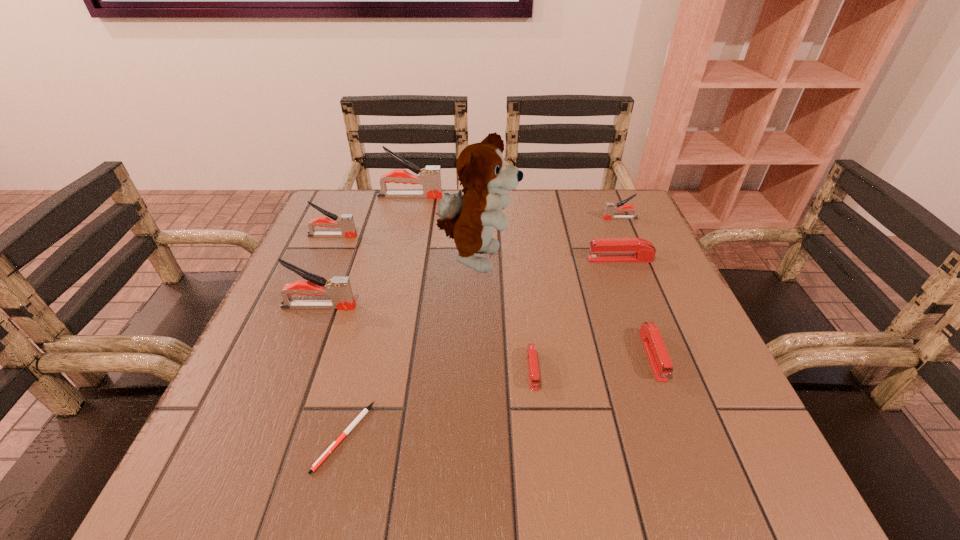
Identify the location of vacant space located 0.280m on the handle side of the sixth shortest stapler. The image size is (960, 540). (491, 307).

You are a GUI agent. You are given a task and a screenshot of the screen. Output one action in this format:
    pyautogui.click(x=<x>, y=<y>)
    Task: Click on the vacant area located 0.350m on the handle side of the second smallest gray stapler
    This screenshot has height=540, width=960.
    Given the screenshot: What is the action you would take?
    pyautogui.click(x=496, y=236)

This screenshot has width=960, height=540. Find the location of `vacant space located 0.280m on the handle side of the rightmost gray stapler`. vacant space located 0.280m on the handle side of the rightmost gray stapler is located at coordinates (496, 218).

Where is `vacant region located on the handle side of the rightmost gray stapler`? vacant region located on the handle side of the rightmost gray stapler is located at coordinates (554, 218).

At what (x,y) coordinates should I click in order to perform the action: click on vacant space located on the handle side of the rightmost gray stapler. Please return your answer as a coordinate pair (x, y). This screenshot has width=960, height=540. Looking at the image, I should click on (500, 218).

At what (x,y) coordinates should I click in order to perform the action: click on free point located 0.210m on the front-facing side of the sixth tallest object. Please return your answer as a coordinate pair (x, y). This screenshot has width=960, height=540. Looking at the image, I should click on (498, 259).

Locate an element on the screen. The height and width of the screenshot is (540, 960). free space located 0.220m on the front-facing side of the sixth tallest object is located at coordinates (493, 259).

I want to click on vacant space located 0.300m on the front-facing side of the sixth tallest object, so click(460, 259).

This screenshot has width=960, height=540. I want to click on vacant space located on the front-facing side of the second smallest red stapler, so click(x=699, y=480).

What are the coordinates of `free region located 0.140m on the front-facing side of the second shortest object` in the screenshot? It's located at (543, 471).